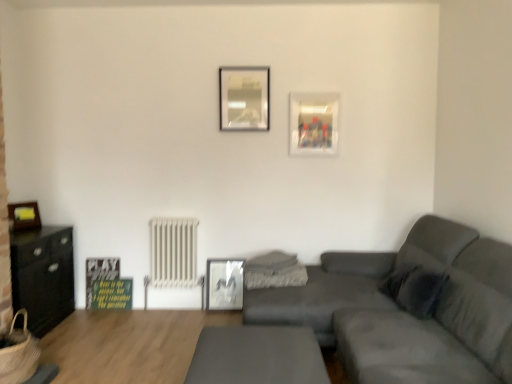
Question: Considering the positions of matte gray couch at center and white metallic radiator at center-left in the image, is matte gray couch at center taller or shorter than white metallic radiator at center-left?

Choices:
 (A) short
 (B) tall

Answer: (B)

Question: Based on their positions, is matte gray couch at center located to the left or right of white metallic radiator at center-left?

Choices:
 (A) right
 (B) left

Answer: (A)

Question: Which object is positioned farthest from the black matte cabinet at left?

Choices:
 (A) braided straw basket at lower left
 (B) metallic silver picture frame at center, marked as the third picture frame in a right-to-left arrangement
 (C) smooth gray table at center
 (D) white metallic radiator at center-left
 (E) matte black picture frame at left, which is the second picture frame from bottom to top

Answer: (C)

Question: Which of these objects is positioned farthest from the black matte cabinet at left?

Choices:
 (A) metallic silver picture frame at center, positioned as the 1th picture frame in bottom-to-top order
 (B) matte gray couch at center
 (C) braided straw basket at lower left
 (D) white metallic radiator at center-left
 (E) smooth gray table at center

Answer: (B)